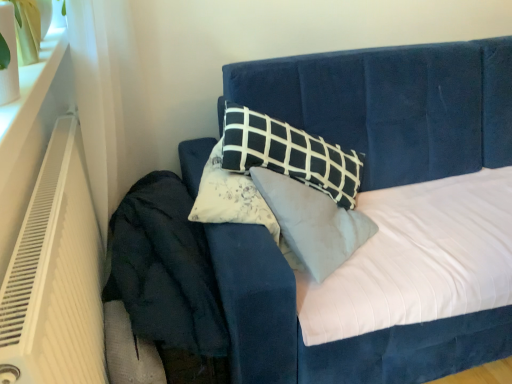
This screenshot has width=512, height=384. Identify the location of vacant region above white plastic heater at left (from a real-world perspective). (49, 172).